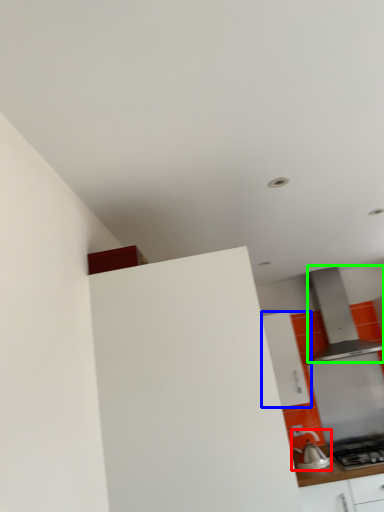
Question: Considering the real-world distances, which object is closest to kitchen appliance (highlighted by a red box)? cabinetry (highlighted by a blue box) or home appliance (highlighted by a green box).

Choices:
 (A) cabinetry
 (B) home appliance

Answer: (A)